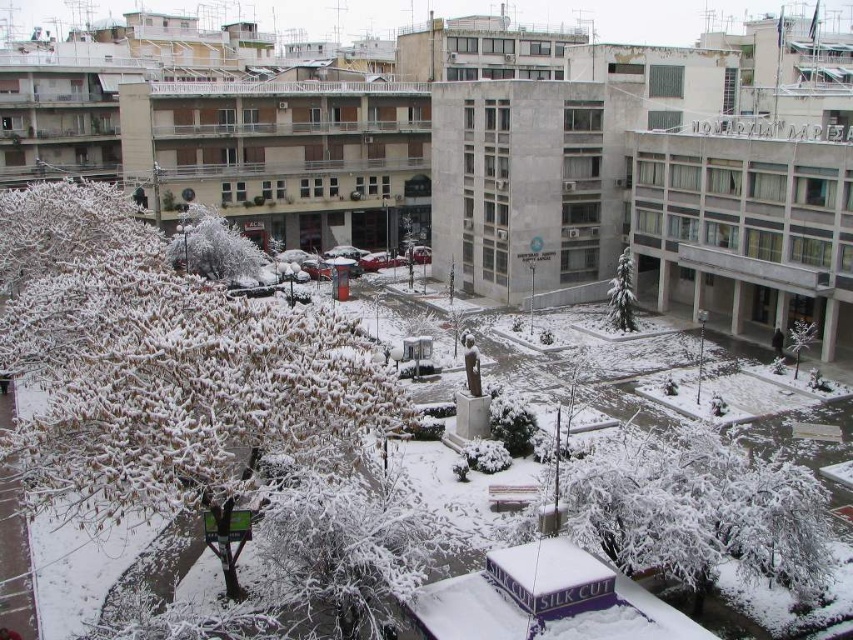
Which is more to the right, white snow-covered tree at left or white frosted tree at center?

white frosted tree at center is more to the right.

Is white snow-covered tree at left thinner than white frosted tree at center?

Incorrect, white snow-covered tree at left's width is not less than white frosted tree at center's.

Does point (120, 474) come farther from viewer compared to point (799, 337)?

No, (120, 474) is closer to viewer.

The width and height of the screenshot is (853, 640). I want to click on white snow-covered tree at left, so click(x=161, y=364).

Between white snow-covered tree at left and white frosty tree at center, which one appears on the right side from the viewer's perspective?

white snow-covered tree at left

Consider the image. Does white snow-covered tree at left have a lesser height compared to white frosty tree at center?

No.

Where is `white snow-covered tree at left`? This screenshot has width=853, height=640. white snow-covered tree at left is located at coordinates (161, 364).

Locate an element on the screen. The height and width of the screenshot is (640, 853). white snow-covered tree at left is located at coordinates pyautogui.click(x=161, y=364).

Can you confirm if white snow-covered tree at left is positioned above green matte tree at center?

No.

Does white snow-covered tree at left have a greater width compared to green matte tree at center?

Yes.

Which is in front, point (7, 312) or point (622, 317)?

Point (7, 312) is more forward.

Find the location of `white snow-covered tree at left`. white snow-covered tree at left is located at coordinates click(161, 364).